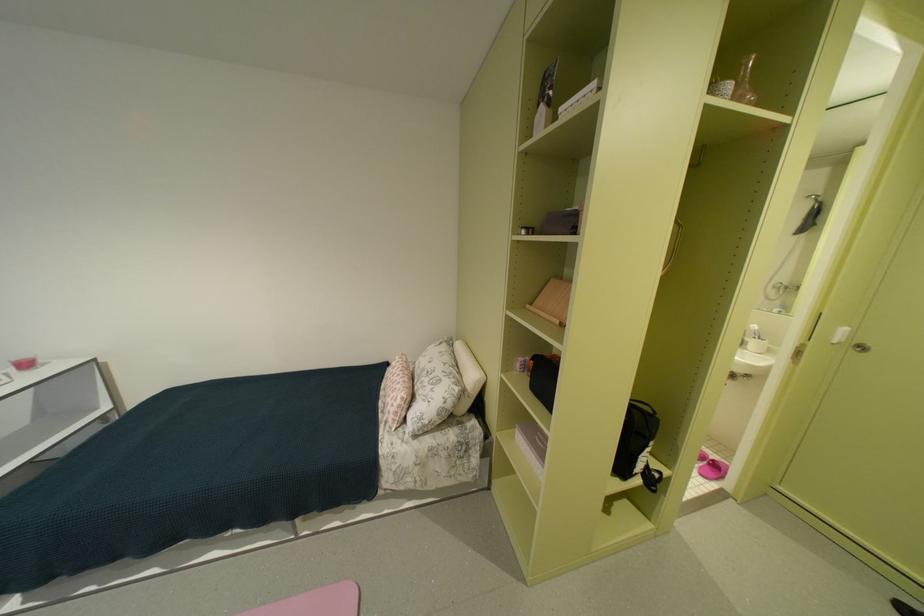
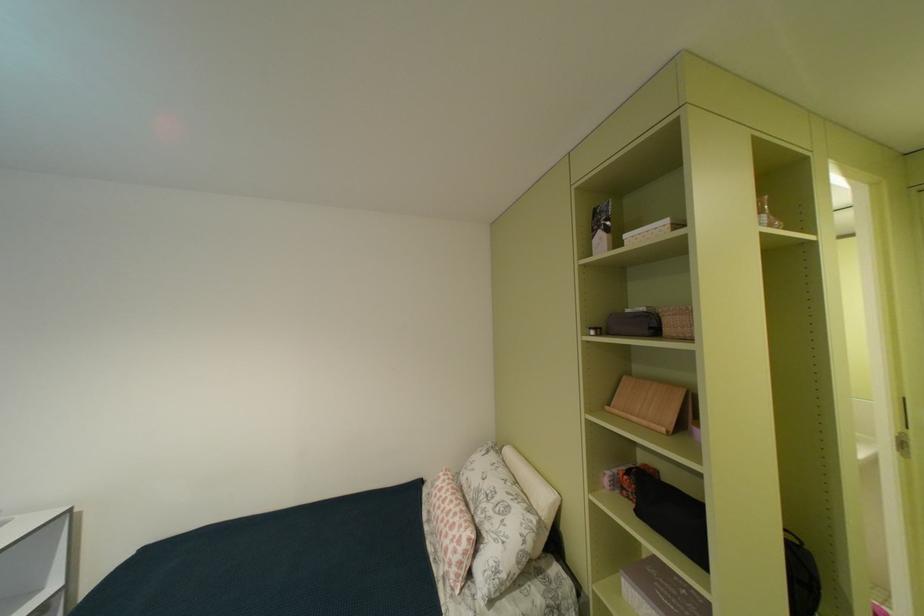
In the second image, find the point that corresponds to point (807, 346) in the first image.

(905, 435)